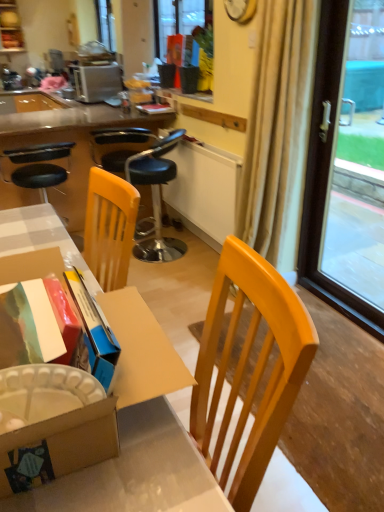
Question: Is matte black flowerpot at upper center outside black leather stool at center, the first chair from the right?

Choices:
 (A) yes
 (B) no

Answer: (A)

Question: Is the depth of matte black flowerpot at upper center less than that of black leather stool at center, the first chair from the right?

Choices:
 (A) no
 (B) yes

Answer: (A)

Question: Can you confirm if matte black flowerpot at upper center is positioned to the left of black leather stool at center, the first chair from the right?

Choices:
 (A) yes
 (B) no

Answer: (B)

Question: From the image's perspective, is matte black flowerpot at upper center located above black leather stool at center, which is the 2th chair from left to right?

Choices:
 (A) yes
 (B) no

Answer: (A)

Question: Considering the relative sizes of matte black flowerpot at upper center and black leather stool at center, which is the 2th chair from left to right, in the image provided, is matte black flowerpot at upper center wider than black leather stool at center, which is the 2th chair from left to right,?

Choices:
 (A) no
 (B) yes

Answer: (A)

Question: Is satin silver toaster at upper left in front of or behind black leather stool at center, which is the 2th chair from left to right, in the image?

Choices:
 (A) front
 (B) behind

Answer: (B)

Question: From their relative heights in the image, would you say satin silver toaster at upper left is taller or shorter than black leather stool at center, the first chair from the right?

Choices:
 (A) tall
 (B) short

Answer: (B)

Question: Is satin silver toaster at upper left to the left or to the right of black leather stool at center, which is the 2th chair from left to right, in the image?

Choices:
 (A) left
 (B) right

Answer: (A)

Question: Does point (x=84, y=79) appear closer or farther from the camera than point (x=165, y=167)?

Choices:
 (A) closer
 (B) farther

Answer: (B)

Question: Considering the relative positions of satin silver toaster at upper left and matte black desk at center, the 2th desk from the bottom, in the image provided, is satin silver toaster at upper left to the left or to the right of matte black desk at center, the 2th desk from the bottom,?

Choices:
 (A) right
 (B) left

Answer: (B)

Question: Is point (82, 67) positioned closer to the camera than point (87, 186)?

Choices:
 (A) farther
 (B) closer

Answer: (A)

Question: Which is correct: satin silver toaster at upper left is inside matte black desk at center, which ranks as the 1th desk in top-to-bottom order, or outside of it?

Choices:
 (A) outside
 (B) inside

Answer: (A)

Question: Is satin silver toaster at upper left in front of or behind matte black desk at center, the 2th desk from the bottom, in the image?

Choices:
 (A) behind
 (B) front

Answer: (A)

Question: Based on their positions, is wooden desk at center, arranged as the 1th desk when viewed from the front, located to the left or right of transparent glass window at right?

Choices:
 (A) left
 (B) right

Answer: (A)

Question: In terms of width, does wooden desk at center, which appears as the first desk when ordered from the bottom, look wider or thinner when compared to transparent glass window at right?

Choices:
 (A) wide
 (B) thin

Answer: (A)